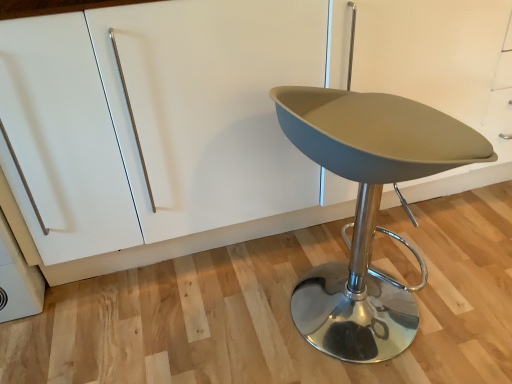
Question: Does matte gray stool at center have a larger size compared to white matte cabinet at center?

Choices:
 (A) no
 (B) yes

Answer: (A)

Question: From a real-world perspective, is matte gray stool at center over white matte cabinet at center?

Choices:
 (A) yes
 (B) no

Answer: (B)

Question: Does matte gray stool at center contain white matte cabinet at center?

Choices:
 (A) no
 (B) yes

Answer: (A)

Question: Is matte gray stool at center positioned before white matte cabinet at center?

Choices:
 (A) yes
 (B) no

Answer: (A)

Question: From the image's perspective, is matte gray stool at center located above white matte cabinet at center?

Choices:
 (A) no
 (B) yes

Answer: (A)

Question: Is matte gray stool at center not inside white matte cabinet at center?

Choices:
 (A) yes
 (B) no

Answer: (A)

Question: From the image's perspective, is white matte cabinet at center on top of matte gray stool at center?

Choices:
 (A) no
 (B) yes

Answer: (B)

Question: Is matte gray stool at center a part of white matte cabinet at center?

Choices:
 (A) yes
 (B) no

Answer: (B)

Question: From the image's perspective, is white matte cabinet at center under matte gray stool at center?

Choices:
 (A) no
 (B) yes

Answer: (A)

Question: Is white matte cabinet at center aimed at matte gray stool at center?

Choices:
 (A) yes
 (B) no

Answer: (A)

Question: Can you confirm if white matte cabinet at center is taller than matte gray stool at center?

Choices:
 (A) yes
 (B) no

Answer: (A)

Question: Considering the relative sizes of white matte cabinet at center and matte gray stool at center in the image provided, is white matte cabinet at center thinner than matte gray stool at center?

Choices:
 (A) no
 (B) yes

Answer: (A)

Question: Looking at their shapes, would you say white matte cabinet at center is wider or thinner than matte gray stool at center?

Choices:
 (A) thin
 (B) wide

Answer: (B)